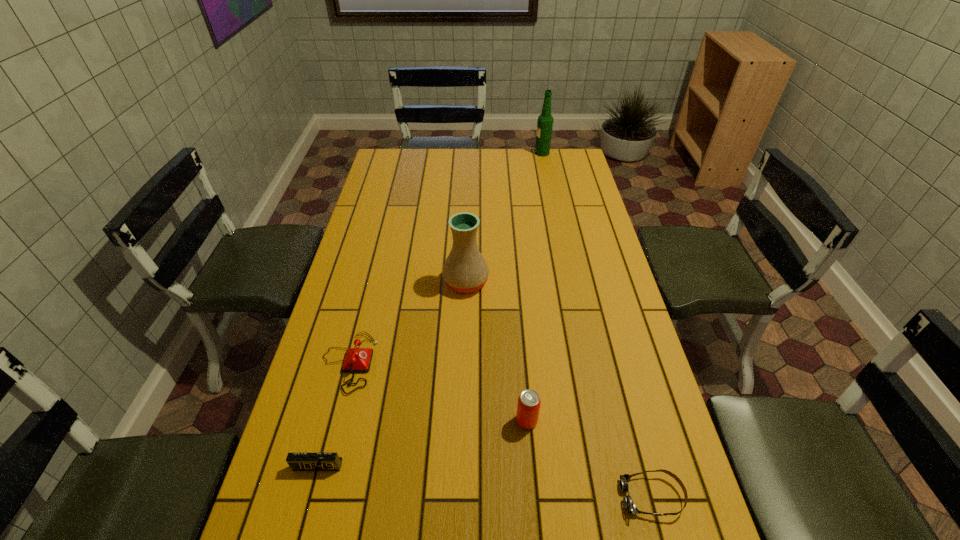
Locate an element on the screen. This screenshot has width=960, height=540. beer bottle is located at coordinates (545, 121).

Find the location of `the farthest object`. the farthest object is located at coordinates (545, 121).

The height and width of the screenshot is (540, 960). I want to click on the second farthest object, so click(465, 270).

Where is `pottery`? The height and width of the screenshot is (540, 960). pottery is located at coordinates (465, 270).

Where is `the third nearest object`? the third nearest object is located at coordinates (528, 407).

I want to click on beer can, so click(528, 407).

The height and width of the screenshot is (540, 960). Find the location of `telephone`. telephone is located at coordinates (358, 359).

Where is `alarm clock`? alarm clock is located at coordinates (297, 461).

This screenshot has width=960, height=540. Identify the location of goggles. (629, 505).

The height and width of the screenshot is (540, 960). I want to click on the nearest object, so click(x=629, y=505).